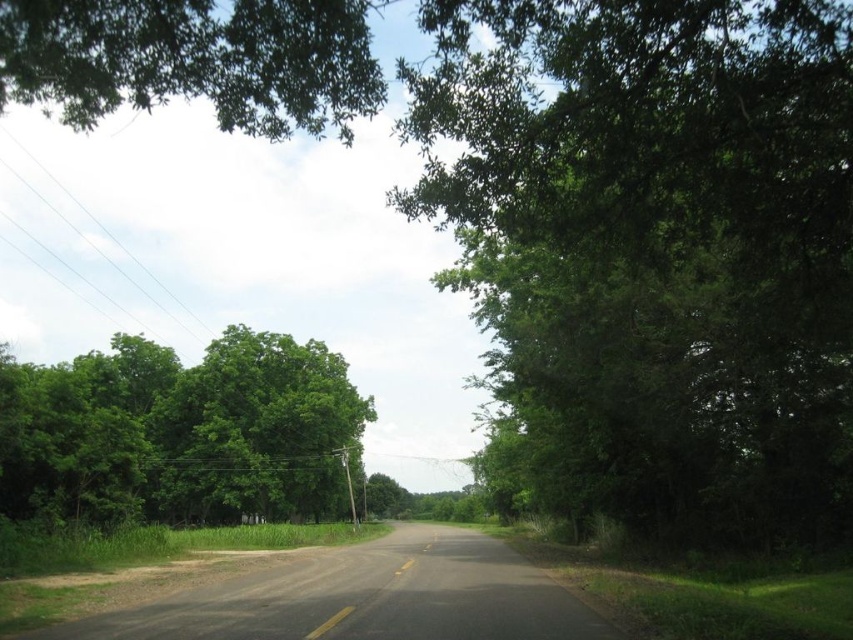
Can you confirm if green leafy tree at center is thinner than green leafy tree at left?

Correct, green leafy tree at center's width is less than green leafy tree at left's.

Does point (601, 35) come in front of point (260, 429)?

Yes, point (601, 35) is in front of point (260, 429).

Who is more distant from viewer, (606, 372) or (259, 392)?

Positioned behind is point (259, 392).

I want to click on green leafy tree at center, so click(x=659, y=250).